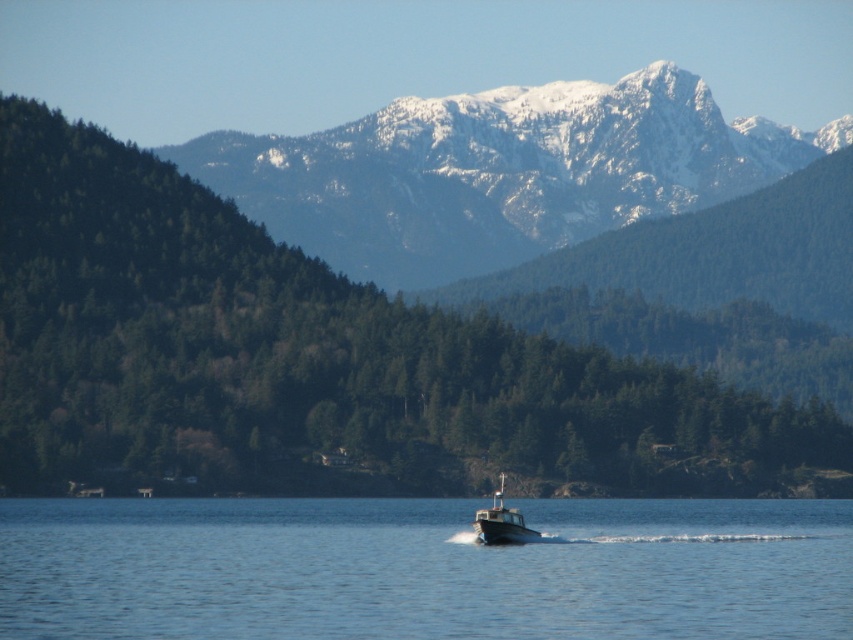
You are planning a photography shoot and need to capture both the snowy rocky mountain range at upper center and the white plastic boat at center in the same frame. Based on their sizes in the image, which object will occupy more of the horizontal space in your photo?

The snowy rocky mountain range at upper center will occupy more horizontal space in the photo because its width is larger than the white plastic boat at center.

You are standing at the edge of the water in the serene landscape scene. There are two points marked on the image at coordinates point (450, 516) and point (500, 525). If you were to walk towards these points, which point would you reach first?

You would reach point (450, 516) first because it is closer to you than point (500, 525), which is further away.